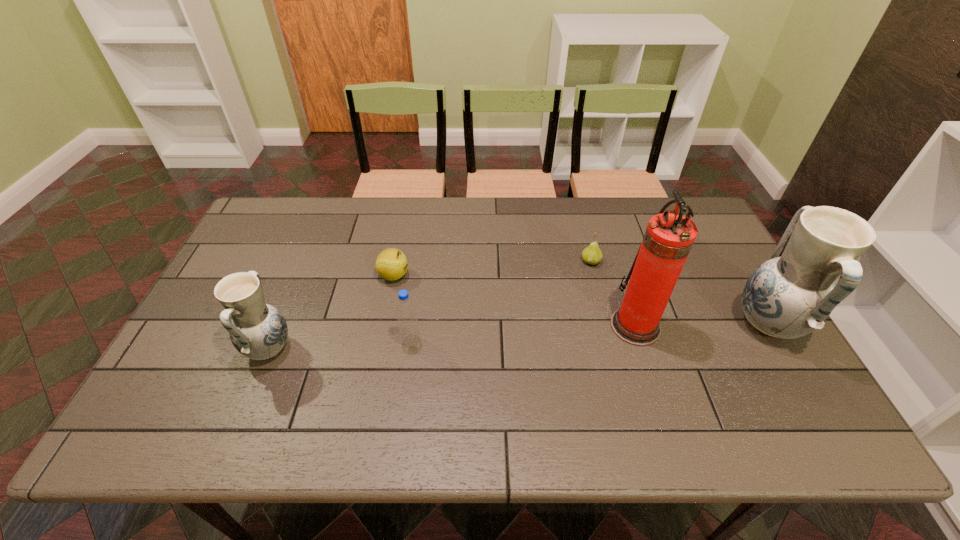
Find the location of `vacant position in the image that satisfies the following two spatial constraints: 1. on the logo side of the softball; 2. on the back side of the fourth object from right to left`. vacant position in the image that satisfies the following two spatial constraints: 1. on the logo side of the softball; 2. on the back side of the fourth object from right to left is located at coordinates (381, 341).

You are a GUI agent. You are given a task and a screenshot of the screen. Output one action in this format:
    pyautogui.click(x=<x>, y=<y>)
    Task: Click on the free space that satisfies the following two spatial constraints: 1. on the front side of the pear; 2. on either side of the left pottery
    This screenshot has height=540, width=960.
    Given the screenshot: What is the action you would take?
    pyautogui.click(x=613, y=348)